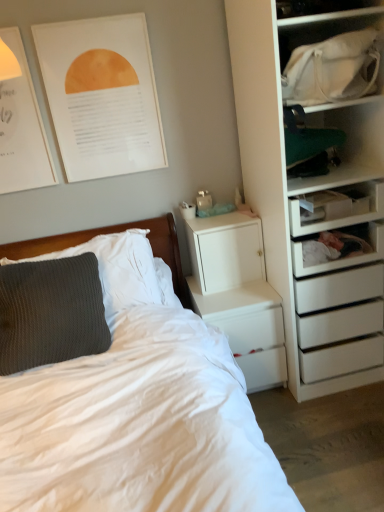
Identify the location of free space in front of white matte/file cabinet at upper right. (235, 297).